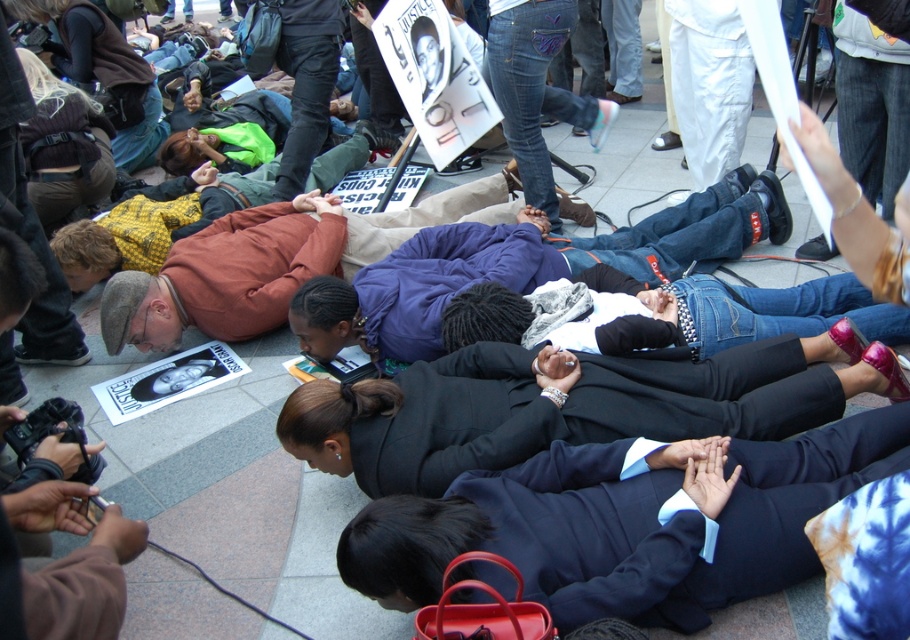
Which is more to the right, black suit at center or denim jacket at center?

Positioned to the right is black suit at center.

Who is more forward, (321, 419) or (372, 326)?

Point (321, 419) is in front.

Is point (344, 401) positioned behind point (483, 241)?

No, (344, 401) is closer to viewer.

This screenshot has height=640, width=910. What are the coordinates of `black suit at center` in the screenshot? It's located at (565, 404).